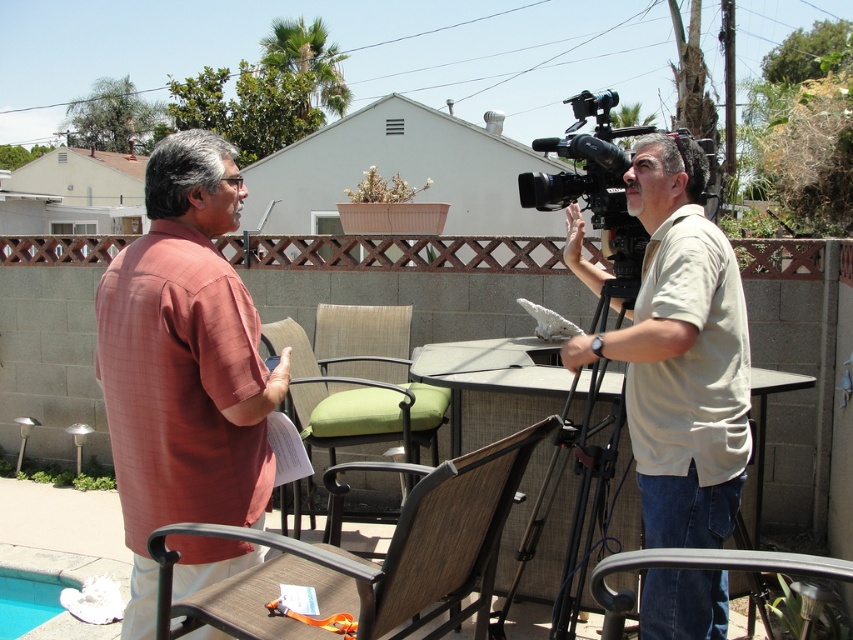
Question: Is brown woven chair at lower center thinner than metallic silver chair at lower center?

Choices:
 (A) no
 (B) yes

Answer: (A)

Question: Is beige cotton shirt at center to the left of brown woven chair at lower center from the viewer's perspective?

Choices:
 (A) no
 (B) yes

Answer: (A)

Question: Which point appears closest to the camera in this image?

Choices:
 (A) (259, 474)
 (B) (437, 372)
 (C) (3, 625)

Answer: (A)

Question: Which point is closer to the camera?

Choices:
 (A) metallic silver chair at lower center
 (B) blue smooth pool at lower left
 (C) beige cotton shirt at center
 (D) black plastic video camera at right

Answer: (A)

Question: Is metallic silver chair at lower center closer to the viewer compared to blue smooth pool at lower left?

Choices:
 (A) no
 (B) yes

Answer: (B)

Question: Which object is farther from the camera taking this photo?

Choices:
 (A) green fabric chair at center
 (B) brown woven chair at lower center
 (C) metallic silver chair at lower center
 (D) plaid cotton shirt at center

Answer: (A)